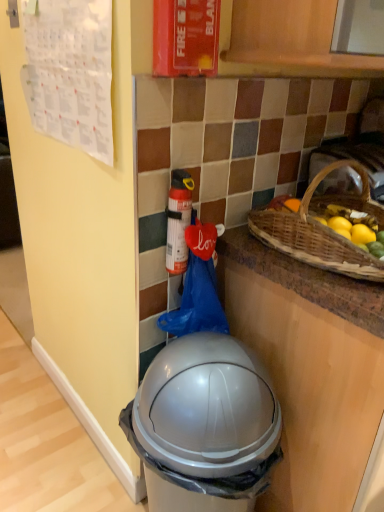
Question: Should I look upward or downward to see silver plastic trash can at lower center?

Choices:
 (A) up
 (B) down

Answer: (B)

Question: Is brown woven picnic basket at upper right at the right side of red matte fire extinguisher at center?

Choices:
 (A) yes
 (B) no

Answer: (A)

Question: From a real-world perspective, is brown woven picnic basket at upper right on red matte fire extinguisher at center?

Choices:
 (A) yes
 (B) no

Answer: (A)

Question: Is red matte fire extinguisher at center surrounded by brown woven picnic basket at upper right?

Choices:
 (A) no
 (B) yes

Answer: (A)

Question: Is brown woven picnic basket at upper right touching red matte fire extinguisher at center?

Choices:
 (A) yes
 (B) no

Answer: (B)

Question: Does brown woven picnic basket at upper right lie behind red matte fire extinguisher at center?

Choices:
 (A) yes
 (B) no

Answer: (B)

Question: Is brown woven picnic basket at upper right facing towards red matte fire extinguisher at center?

Choices:
 (A) no
 (B) yes

Answer: (A)

Question: Is the surface of silver plastic trash can at lower center in direct contact with red matte fire extinguisher at upper center?

Choices:
 (A) no
 (B) yes

Answer: (A)

Question: From the image's perspective, is silver plastic trash can at lower center located beneath red matte fire extinguisher at upper center?

Choices:
 (A) no
 (B) yes

Answer: (B)

Question: Considering the relative sizes of silver plastic trash can at lower center and red matte fire extinguisher at upper center in the image provided, is silver plastic trash can at lower center bigger than red matte fire extinguisher at upper center?

Choices:
 (A) yes
 (B) no

Answer: (A)

Question: Is silver plastic trash can at lower center further to the viewer compared to red matte fire extinguisher at upper center?

Choices:
 (A) no
 (B) yes

Answer: (A)

Question: Considering the relative sizes of silver plastic trash can at lower center and red matte fire extinguisher at upper center in the image provided, is silver plastic trash can at lower center shorter than red matte fire extinguisher at upper center?

Choices:
 (A) yes
 (B) no

Answer: (B)

Question: Is silver plastic trash can at lower center aimed at red matte fire extinguisher at upper center?

Choices:
 (A) no
 (B) yes

Answer: (A)

Question: Is silver plastic trash can at lower center a part of red matte fire extinguisher at center?

Choices:
 (A) yes
 (B) no

Answer: (B)